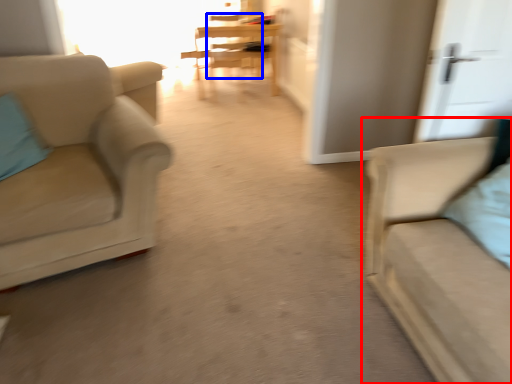
Question: Which object appears closest to the camera in this image, studio couch (highlighted by a red box) or armchair (highlighted by a blue box)?

Choices:
 (A) studio couch
 (B) armchair

Answer: (A)